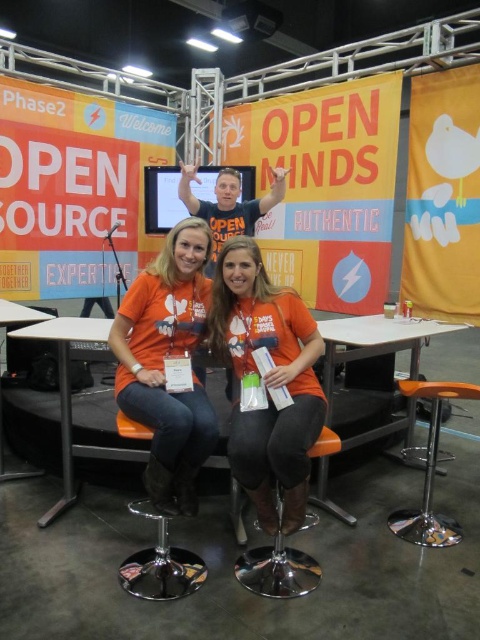
Does orange plastic table at lower right lie behind white plastic table at center?

Yes, orange plastic table at lower right is further from the viewer.

Is orange plastic table at lower right positioned before white plastic table at center?

No.

Is point (370, 324) in front of point (68, 433)?

That is False.

The height and width of the screenshot is (640, 480). Find the location of `orange plastic table at lower right`. orange plastic table at lower right is located at coordinates (373, 342).

Is point (288, 449) farther from viewer compared to point (203, 388)?

No, it is not.

Is orange fabric shirt at center behind orange matte shirt at center?

No.

Is point (243, 454) farther from camera compared to point (207, 413)?

That is False.

The width and height of the screenshot is (480, 640). Identify the location of orange fabric shirt at center. (267, 380).

Which is more to the right, orange fabric shirt at center or orange plastic table at lower right?

orange plastic table at lower right is more to the right.

Is point (244, 291) positioned before point (405, 348)?

Yes, point (244, 291) is closer to viewer.

This screenshot has width=480, height=640. In order to click on orange fabric shirt at center in this screenshot , I will do `click(267, 380)`.